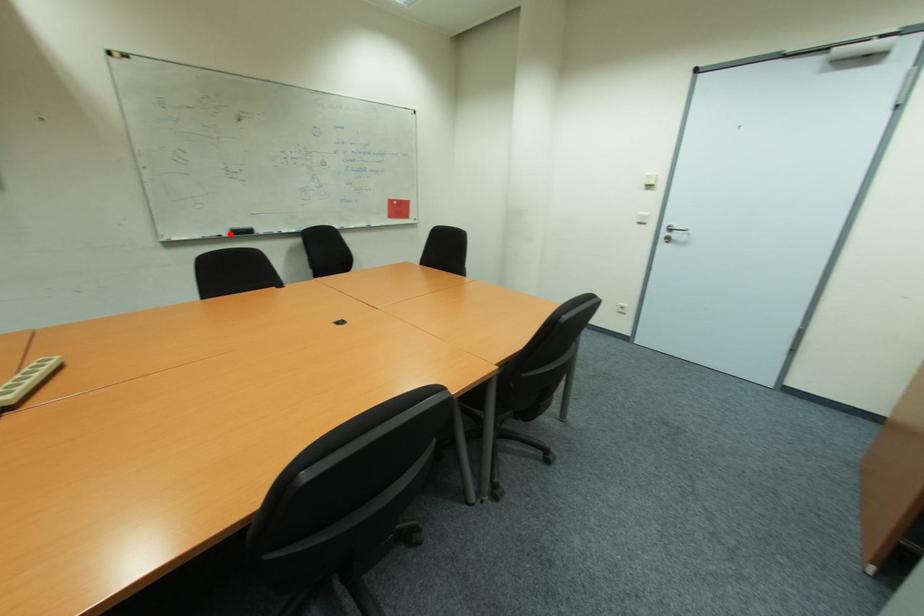
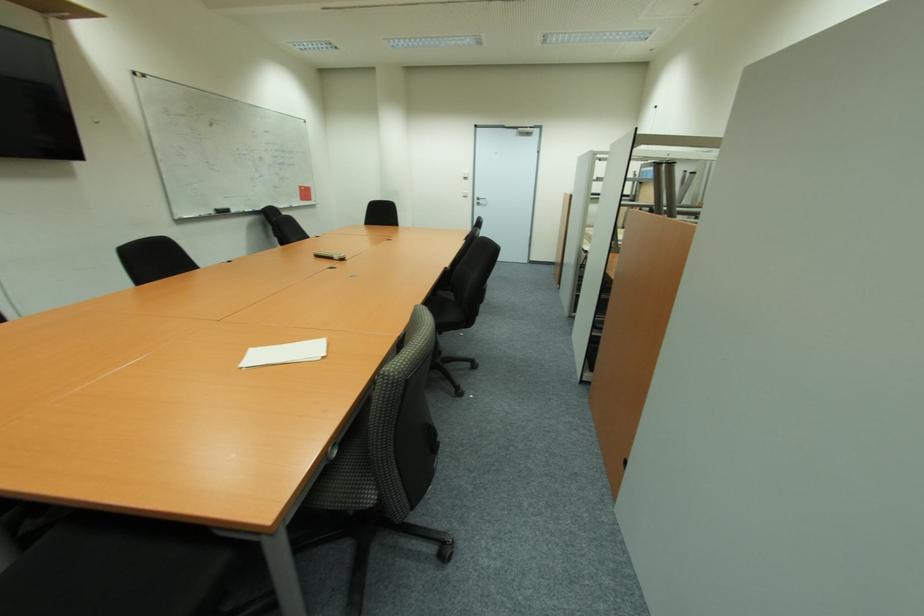
Question: I am providing you with two images of the same scene from different viewpoints. A red point is marked on the first image. Can you still see the location of the red point in image 2?

Choices:
 (A) Yes
 (B) No

Answer: (A)